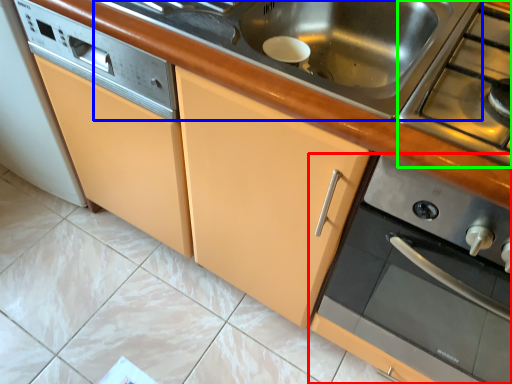
Question: Which object is positioned closest to home appliance (highlighted by a red box)? Select from sink (highlighted by a blue box) and gas stove (highlighted by a green box).

Choices:
 (A) sink
 (B) gas stove

Answer: (B)